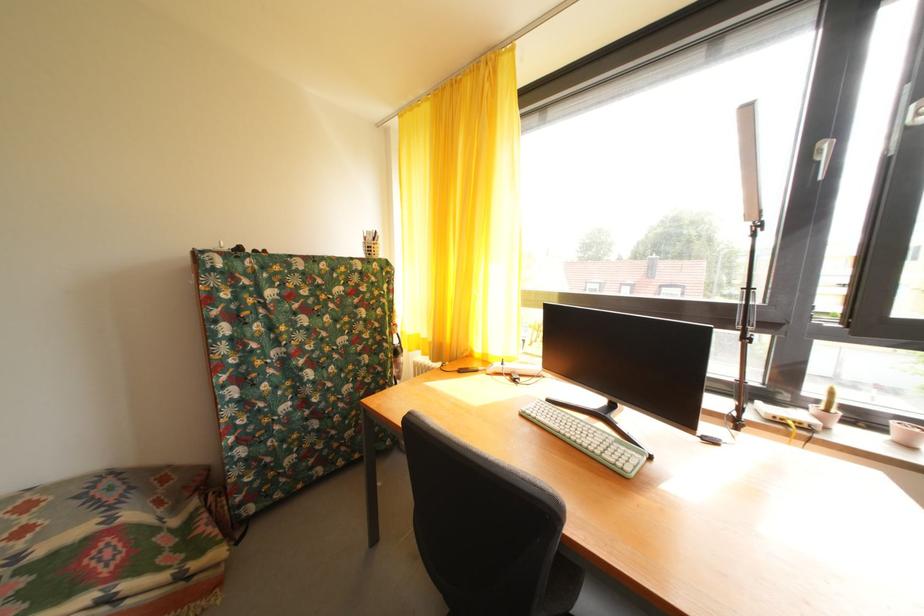
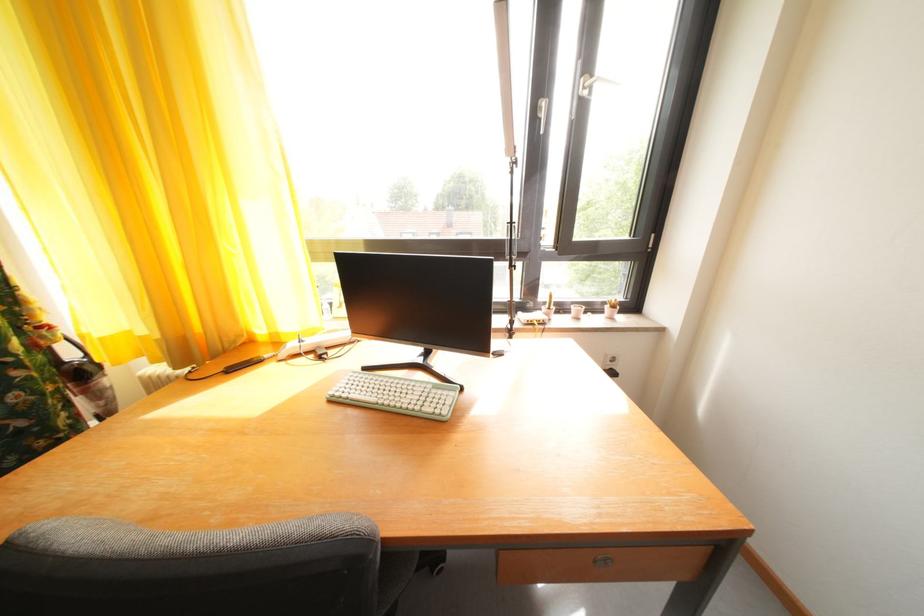
Question: How did the camera likely rotate?

Choices:
 (A) Left
 (B) Right
 (C) Up
 (D) Down

Answer: (B)